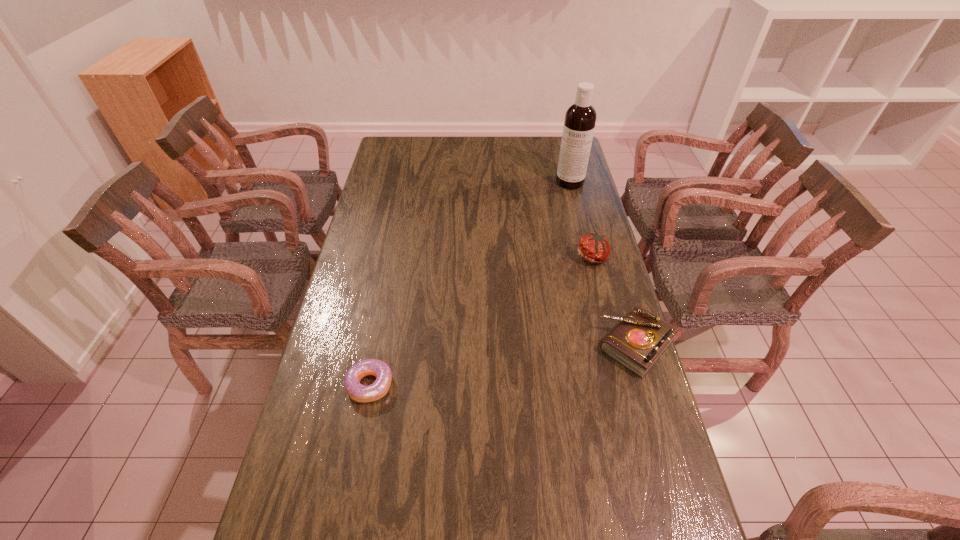
At what (x,y) coordinates should I click in order to perform the action: click on free space at the left edge. Please return your answer as a coordinate pair (x, y). Looking at the image, I should click on [308, 424].

In the image, there is a desktop. In order to click on free space at the right edge in this screenshot , I will do point(606,332).

You are a GUI agent. You are given a task and a screenshot of the screen. Output one action in this format:
    pyautogui.click(x=<x>, y=<y>)
    Task: Click on the vacant space at the far left corner of the desktop
    Image resolution: width=960 pixels, height=540 pixels.
    Given the screenshot: What is the action you would take?
    pyautogui.click(x=384, y=162)

Identify the location of vacant position at the near right corner of the desktop. (619, 497).

Locate an element on the screen. The image size is (960, 540). vacant space that's between the shortest object and the tallest object is located at coordinates (469, 284).

Identify the location of free space between the dishwasher detergent and the tomato. The height and width of the screenshot is (540, 960). (582, 219).

Locate an element on the screen. The height and width of the screenshot is (540, 960). vacant area that lies between the second shortest object and the tallest object is located at coordinates (604, 264).

Identify the location of vacant space in between the doughnut and the third nearest object. This screenshot has width=960, height=540. (482, 321).

The width and height of the screenshot is (960, 540). What are the coordinates of `free space between the doughnut and the second shortest object` in the screenshot? It's located at (x=503, y=365).

This screenshot has height=540, width=960. I want to click on free space between the shortest object and the dishwasher detergent, so click(469, 284).